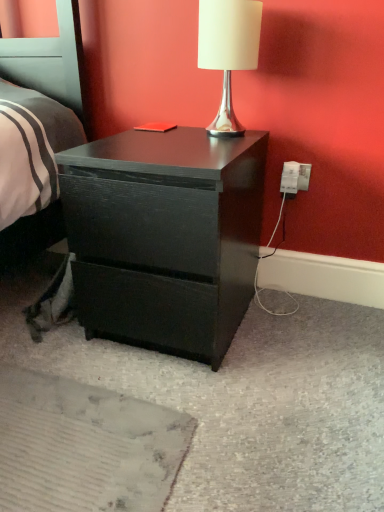
Question: Is matte black nightstand at center wider or thinner than white glossy table lamp at upper center?

Choices:
 (A) wide
 (B) thin

Answer: (A)

Question: Is matte black nightstand at center spatially inside white glossy table lamp at upper center, or outside of it?

Choices:
 (A) outside
 (B) inside

Answer: (A)

Question: Which of these objects is positioned farthest from the white glossy table lamp at upper center?

Choices:
 (A) white plastic electric outlet at lower right
 (B) matte black nightstand at center

Answer: (B)

Question: Which object is positioned farthest from the white plastic electric outlet at lower right?

Choices:
 (A) white glossy table lamp at upper center
 (B) matte black nightstand at center

Answer: (B)